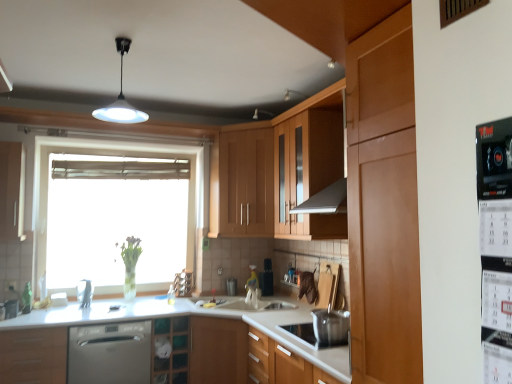
Question: Is transparent glass window at center wider than white glossy sink at center?

Choices:
 (A) yes
 (B) no

Answer: (B)

Question: Is transparent glass window at center outside of white glossy sink at center?

Choices:
 (A) no
 (B) yes

Answer: (B)

Question: Is the depth of transparent glass window at center less than that of white glossy sink at center?

Choices:
 (A) yes
 (B) no

Answer: (B)

Question: Is transparent glass window at center oriented towards white glossy sink at center?

Choices:
 (A) yes
 (B) no

Answer: (A)

Question: From a real-world perspective, is transparent glass window at center over white glossy sink at center?

Choices:
 (A) yes
 (B) no

Answer: (A)

Question: In terms of height, does black plastic calendar at right, which appears as the 1th appliance when viewed from the front, look taller or shorter compared to matte wood cabinet at lower left, which is the 3th cabinetry from right to left?

Choices:
 (A) tall
 (B) short

Answer: (B)

Question: From a real-world perspective, is black plastic calendar at right, which appears as the first appliance when viewed from the top, above or below matte wood cabinet at lower left, which is the 3th cabinetry from right to left?

Choices:
 (A) above
 (B) below

Answer: (A)

Question: Considering their positions, is black plastic calendar at right, the 1th appliance viewed from the right, located in front of or behind matte wood cabinet at lower left, which is the 3th cabinetry from right to left?

Choices:
 (A) front
 (B) behind

Answer: (A)

Question: Considering the positions of point (487, 177) and point (17, 334), is point (487, 177) closer or farther from the camera than point (17, 334)?

Choices:
 (A) closer
 (B) farther

Answer: (A)

Question: Which is correct: matte wood cabinet at left, marked as the first cabinetry in a left-to-right arrangement, is inside transparent glass window at center, or outside of it?

Choices:
 (A) outside
 (B) inside

Answer: (A)

Question: In terms of width, does matte wood cabinet at left, the fourth cabinetry viewed from the right, look wider or thinner when compared to transparent glass window at center?

Choices:
 (A) wide
 (B) thin

Answer: (A)

Question: Considering the positions of matte wood cabinet at left, the fourth cabinetry viewed from the right, and transparent glass window at center in the image, is matte wood cabinet at left, the fourth cabinetry viewed from the right, taller or shorter than transparent glass window at center?

Choices:
 (A) short
 (B) tall

Answer: (A)

Question: In the image, is matte wood cabinet at left, marked as the first cabinetry in a left-to-right arrangement, on the left side or the right side of transparent glass window at center?

Choices:
 (A) right
 (B) left

Answer: (B)

Question: Is white glossy light fixture at upper center to the left or to the right of matte wood cabinet at left, marked as the first cabinetry in a left-to-right arrangement, in the image?

Choices:
 (A) right
 (B) left

Answer: (A)

Question: Considering the positions of point (119, 115) and point (19, 172), is point (119, 115) closer or farther from the camera than point (19, 172)?

Choices:
 (A) closer
 (B) farther

Answer: (A)